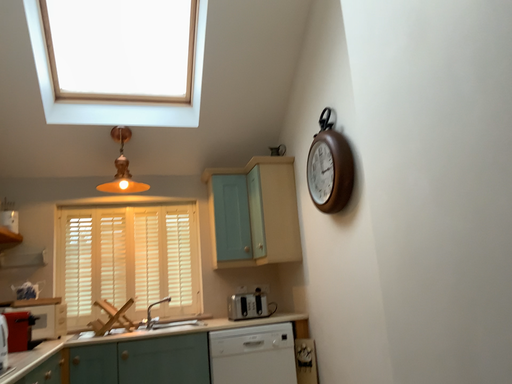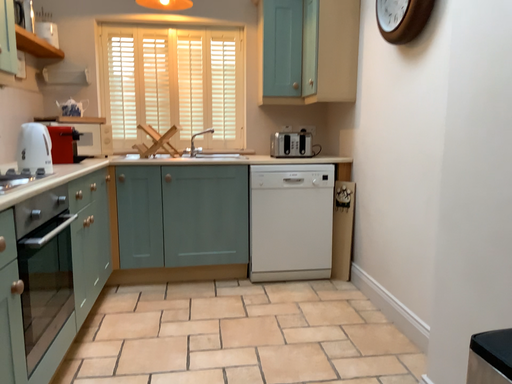
Question: How did the camera likely rotate when shooting the video?

Choices:
 (A) rotated downward
 (B) rotated upward

Answer: (A)